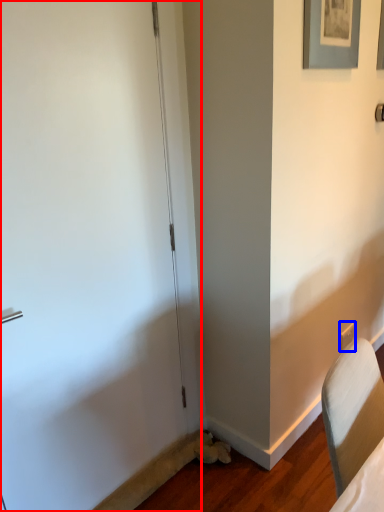
Question: Which object is closer to the camera taking this photo, door (highlighted by a red box) or electric outlet (highlighted by a blue box)?

Choices:
 (A) door
 (B) electric outlet

Answer: (A)